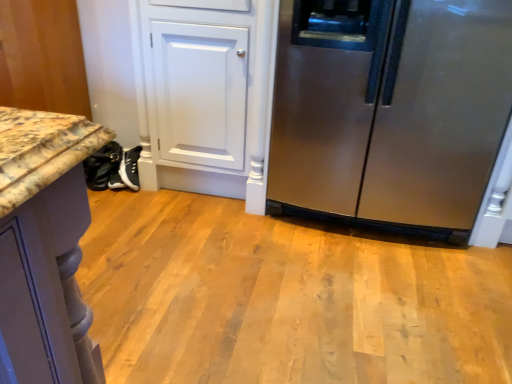
Question: From the image's perspective, is black leather shoes at lower left above or below stainless steel refrigerator at right?

Choices:
 (A) above
 (B) below

Answer: (B)

Question: From their relative heights in the image, would you say black leather shoes at lower left is taller or shorter than stainless steel refrigerator at right?

Choices:
 (A) short
 (B) tall

Answer: (A)

Question: Which of these objects is positioned closest to the marble countertop at lower left?

Choices:
 (A) black leather shoes at lower left
 (B) stainless steel refrigerator at right

Answer: (A)

Question: Based on their relative distances, which object is farther from the marble countertop at lower left?

Choices:
 (A) black leather shoes at lower left
 (B) stainless steel refrigerator at right

Answer: (B)